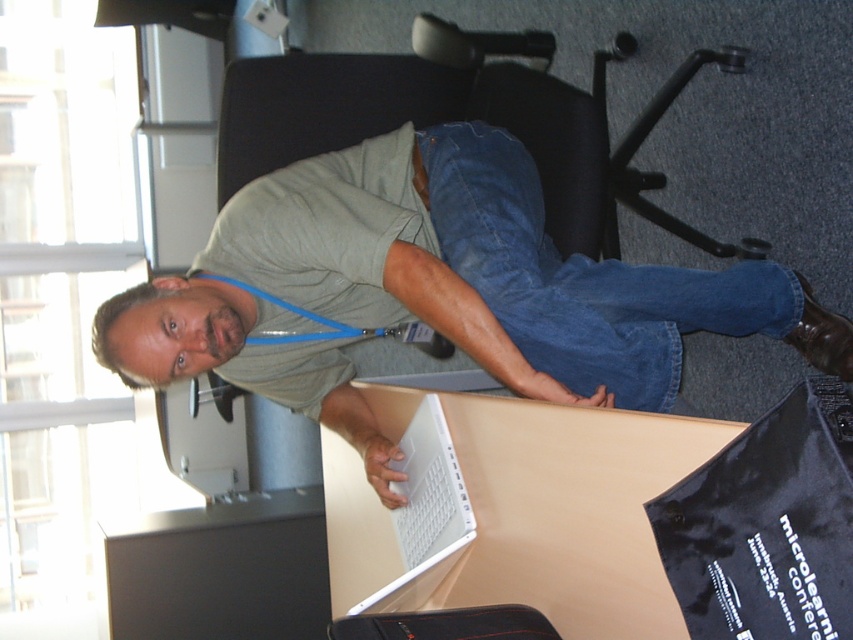
Does matte gray shirt at center have a greater width compared to denim at center?

Correct, the width of matte gray shirt at center exceeds that of denim at center.

Between matte gray shirt at center and denim at center, which one is positioned lower?

Positioned lower is matte gray shirt at center.

Which is behind, point (271, 182) or point (508, 145)?

Positioned behind is point (508, 145).

This screenshot has height=640, width=853. What are the coordinates of `matte gray shirt at center` in the screenshot? It's located at tap(438, 289).

Is matte gray shirt at center above white glossy laptop at center?

Yes.

Which is more to the left, matte gray shirt at center or white glossy laptop at center?

white glossy laptop at center is more to the left.

Image resolution: width=853 pixels, height=640 pixels. What do you see at coordinates (438, 289) in the screenshot? I see `matte gray shirt at center` at bounding box center [438, 289].

Locate an element on the screen. matte gray shirt at center is located at coordinates (438, 289).

Between denim at center and black plastic swivel chair at upper center, which one has less height?

With less height is denim at center.

Identify the location of denim at center. The height and width of the screenshot is (640, 853). (581, 278).